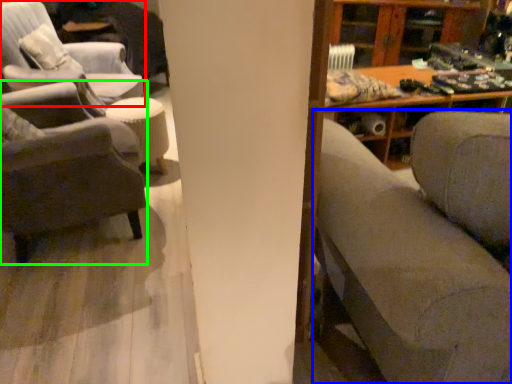
Question: Which is farther away from chair (highlighted by a red box)? studio couch (highlighted by a blue box) or chair (highlighted by a green box)?

Choices:
 (A) studio couch
 (B) chair

Answer: (A)